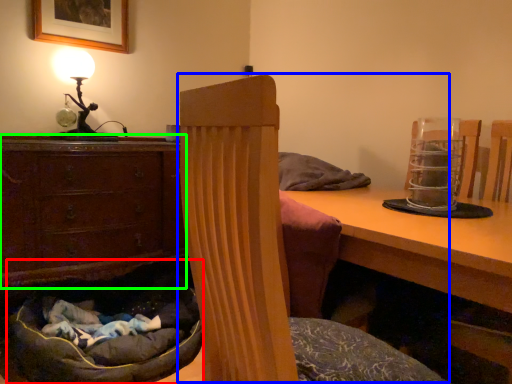
Question: Which object is the closest to the bean bag chair (highlighted by a red box)? Choose among these: bean bag chair (highlighted by a blue box) or chest of drawers (highlighted by a green box).

Choices:
 (A) bean bag chair
 (B) chest of drawers

Answer: (B)